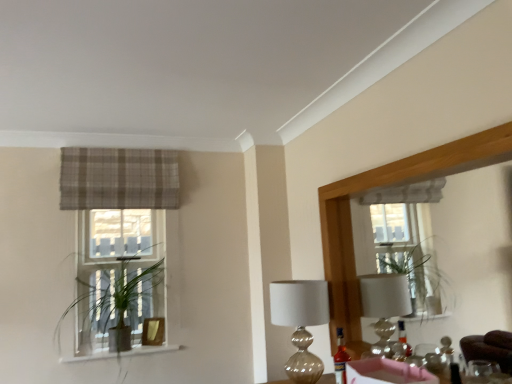
What do you see at coordinates (340, 358) in the screenshot?
I see `translucent glass bottle at center` at bounding box center [340, 358].

Describe the element at coordinates (380, 190) in the screenshot. Image resolution: width=512 pixels, height=384 pixels. I see `wooden mirror at upper right` at that location.

Describe the element at coordinates (300, 322) in the screenshot. I see `metallic glass table lamp at center` at that location.

You are a GUI agent. You are given a task and a screenshot of the screen. Output one action in this format:
    pyautogui.click(x=<x>, y=<y>)
    Task: Click on the matte wood window sill at lower left
    
    Given the screenshot: What is the action you would take?
    pyautogui.click(x=123, y=353)

Is translucent glass bottle at center positioned beyond the bounds of wooden mirror at upper right?

Yes.

Would you say translucent glass bottle at center is to the left or to the right of wooden mirror at upper right in the picture?

In the image, translucent glass bottle at center appears on the left side of wooden mirror at upper right.

How different are the orientations of translucent glass bottle at center and wooden mirror at upper right in degrees?

There is a 3.32-degree angle between the facing directions of translucent glass bottle at center and wooden mirror at upper right.

Is wooden mirror at upper right at the back of translucent glass bottle at center?

Yes, translucent glass bottle at center is facing away from wooden mirror at upper right.

Between green leafy plant at left and plaid fabric curtain at upper left, which one appears on the left side from the viewer's perspective?

green leafy plant at left is more to the left.

Does green leafy plant at left lie in front of plaid fabric curtain at upper left?

Yes.

Can you tell me how much green leafy plant at left and plaid fabric curtain at upper left differ in facing direction?

0.000693 degrees.

Relative to matte wood window sill at lower left, is metallic glass table lamp at center in front or behind?

Visually, metallic glass table lamp at center is located in front of matte wood window sill at lower left.

Can you confirm if metallic glass table lamp at center is shorter than matte wood window sill at lower left?

No.

From the image's perspective, is metallic glass table lamp at center under matte wood window sill at lower left?

No.

Which is more to the left, metallic glass table lamp at center or matte wood window sill at lower left?

From the viewer's perspective, matte wood window sill at lower left appears more on the left side.

Where is `bottle that is in front of the green leafy plant at left`? bottle that is in front of the green leafy plant at left is located at coordinates (340, 358).

Which of these two, green leafy plant at left or translucent glass bottle at center, is bigger?

With larger size is green leafy plant at left.

Is point (141, 264) more distant than point (343, 356)?

Yes, it is behind point (343, 356).

Does wooden mirror at upper right have a greater height compared to translucent glass bottle at center?

Indeed, wooden mirror at upper right has a greater height compared to translucent glass bottle at center.

Looking at this image, is wooden mirror at upper right bigger than translucent glass bottle at center?

Indeed, wooden mirror at upper right has a larger size compared to translucent glass bottle at center.

From the image's perspective, is wooden mirror at upper right beneath translucent glass bottle at center?

No, from the image's perspective, wooden mirror at upper right is not below translucent glass bottle at center.

Is wooden mirror at upper right far from matte wood window sill at lower left?

Absolutely, wooden mirror at upper right is distant from matte wood window sill at lower left.

Is wooden mirror at upper right positioned with its back to matte wood window sill at lower left?

No, wooden mirror at upper right is not facing the opposite direction of matte wood window sill at lower left.

Which is in front, point (343, 298) or point (68, 359)?

The point (343, 298) is closer to the camera.

From the image's perspective, is wooden mirror at upper right above or below matte wood window sill at lower left?

Based on their image positions, wooden mirror at upper right is located above matte wood window sill at lower left.

Measure the distance between green leafy plant at left and wooden mirror at upper right.

green leafy plant at left is 1.54 meters away from wooden mirror at upper right.

Can you confirm if green leafy plant at left is thinner than wooden mirror at upper right?

In fact, green leafy plant at left might be wider than wooden mirror at upper right.

Where is `mirror that is on the right side of green leafy plant at left`? The image size is (512, 384). mirror that is on the right side of green leafy plant at left is located at coordinates (x=380, y=190).

Identify the location of mirror above the translucent glass bottle at center (from a real-world perspective). This screenshot has width=512, height=384. (380, 190).

The image size is (512, 384). In the image, there is a plaid fabric curtain at upper left. Find the location of `houseplant below it (from the image's perspective)`. houseplant below it (from the image's perspective) is located at coordinates (116, 313).

Estimate the real-world distances between objects in this image. Which object is further from green leafy plant at left, wooden mirror at upper right or matte wood window sill at lower left?

wooden mirror at upper right is positioned further to the anchor green leafy plant at left.

When comparing their distances from translucent glass bottle at center, does wooden mirror at upper right or matte wood window sill at lower left seem further?

matte wood window sill at lower left.

When comparing their distances from matte wood window sill at lower left, does green leafy plant at left or translucent glass bottle at center seem further?

The object further to matte wood window sill at lower left is translucent glass bottle at center.

Based on the photo, from the image, which object appears to be nearer to plaid fabric curtain at upper left, wooden mirror at upper right or metallic glass table lamp at center?

metallic glass table lamp at center is positioned closer to the anchor plaid fabric curtain at upper left.

Based on their spatial positions, is translucent glass bottle at center or metallic glass table lamp at center further from plaid fabric curtain at upper left?

translucent glass bottle at center lies further to plaid fabric curtain at upper left than the other object.

From the picture: Which object lies further to the anchor point green leafy plant at left, plaid fabric curtain at upper left or wooden mirror at upper right?

wooden mirror at upper right lies further to green leafy plant at left than the other object.

Which object lies further to the anchor point matte wood window sill at lower left, plaid fabric curtain at upper left or wooden mirror at upper right?

wooden mirror at upper right lies further to matte wood window sill at lower left than the other object.

Considering their positions, is green leafy plant at left positioned closer to wooden mirror at upper right than plaid fabric curtain at upper left?

Among the two, plaid fabric curtain at upper left is located nearer to wooden mirror at upper right.

Find the location of a particular element. Image resolution: width=512 pixels, height=384 pixels. curtain situated between green leafy plant at left and translucent glass bottle at center from left to right is located at coordinates (119, 179).

Identify the location of curtain between matte wood window sill at lower left and translucent glass bottle at center from left to right. Image resolution: width=512 pixels, height=384 pixels. (119, 179).

This screenshot has width=512, height=384. I want to click on window sill positioned between wooden mirror at upper right and plaid fabric curtain at upper left from near to far, so click(123, 353).

At what (x,y) coordinates should I click in order to perform the action: click on window sill situated between green leafy plant at left and translucent glass bottle at center from left to right. Please return your answer as a coordinate pair (x, y). The image size is (512, 384). Looking at the image, I should click on (123, 353).